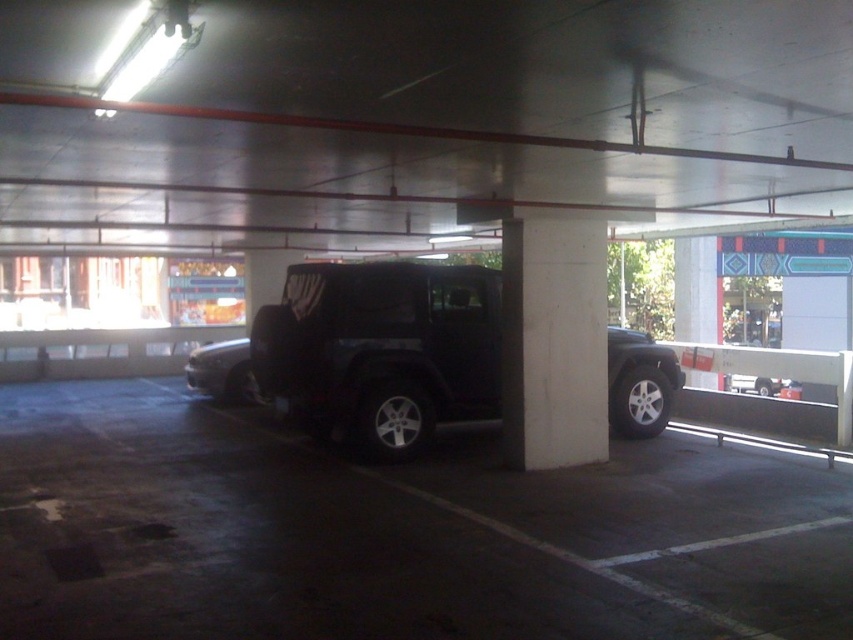
Is matte black jeep at center smaller than matte black suv at center?

No.

Which of these two, matte black jeep at center or matte black suv at center, stands taller?

matte black jeep at center is taller.

Is point (345, 330) positioned behind point (234, 403)?

No, (345, 330) is in front of (234, 403).

This screenshot has width=853, height=640. What are the coordinates of `matte black jeep at center` in the screenshot? It's located at (381, 349).

Does black rubber tire at center appear on the right side of matte black suv at center?

Yes, black rubber tire at center is to the right of matte black suv at center.

Image resolution: width=853 pixels, height=640 pixels. What are the coordinates of `black rubber tire at center` in the screenshot? It's located at (397, 532).

Image resolution: width=853 pixels, height=640 pixels. Identify the location of black rubber tire at center. (397, 532).

Which of these two, black rubber tire at center or matte black jeep at center, stands taller?

With more height is matte black jeep at center.

Is black rubber tire at center positioned behind matte black jeep at center?

No, it is in front of matte black jeep at center.

Who is more forward, (730, 592) or (415, 413)?

Point (730, 592)

At what (x,y) coordinates should I click in order to perform the action: click on black rubber tire at center. Please return your answer as a coordinate pair (x, y). Image resolution: width=853 pixels, height=640 pixels. Looking at the image, I should click on (397, 532).